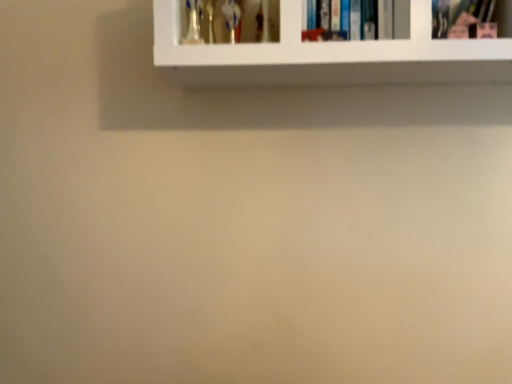
Question: Is pink matte book at upper right, marked as the 1th book in a right-to-left arrangement, inside the boundaries of hardcover book at upper center, acting as the first book starting from the left, or outside?

Choices:
 (A) outside
 (B) inside

Answer: (A)

Question: From the image's perspective, is pink matte book at upper right, marked as the 1th book in a right-to-left arrangement, positioned above or below hardcover book at upper center, arranged as the 2th book when viewed from the front?

Choices:
 (A) below
 (B) above

Answer: (A)

Question: Based on their relative distances, which object is farther from the hardcover book at upper center, the first book in the back-to-front sequence?

Choices:
 (A) white glossy shelf at upper center
 (B) pink matte book at upper right, marked as the 1th book in a right-to-left arrangement

Answer: (B)

Question: Which object is positioned closest to the pink matte book at upper right, the 1th book in the front-to-back sequence?

Choices:
 (A) hardcover book at upper center, the first book in the back-to-front sequence
 (B) white glossy shelf at upper center

Answer: (A)